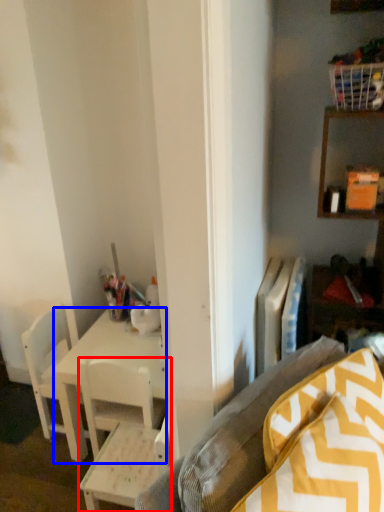
Question: Which object is further to the camera taking this photo, chair (highlighted by a red box) or desk (highlighted by a blue box)?

Choices:
 (A) chair
 (B) desk

Answer: (B)